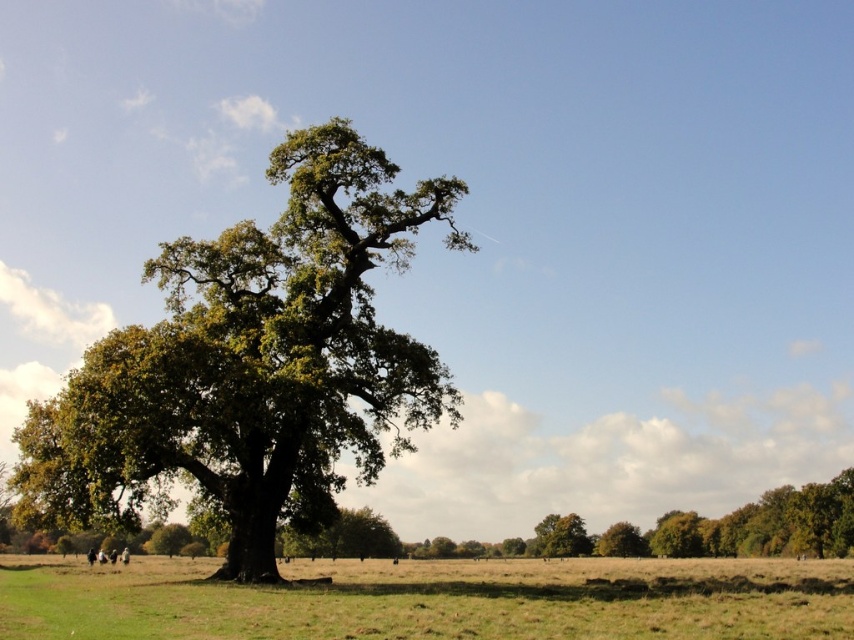
You are planning to plant a new tree in your backyard. You have a green leafy oak tree at left and green grass at center. Which one is taller?

The green grass at center is taller than the green leafy oak tree at left.

You are standing in the field and want to walk towards the green grass at center. Which direction should you walk relative to the green leafy oak tree at left?

To reach the green grass at center, you should walk towards it, which is behind the green leafy oak tree at left. Since the grass is behind the oak tree, you would need to walk around or past the tree to reach it.

You are standing in the middle of the field and want to walk to the tree. Which direction should you head to reach the green leafy oak tree at left from the green grass at center?

You should head to the left side from the green grass at center to reach the green leafy oak tree at left since it is positioned on the left side of the green grass at center.